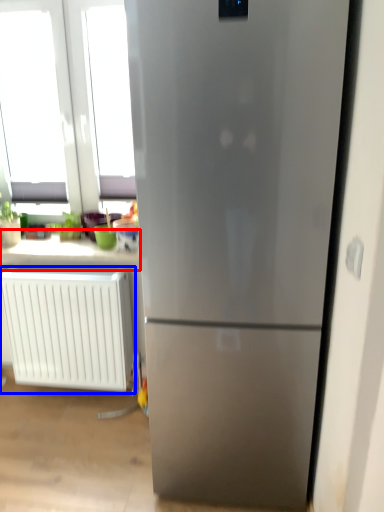
Question: Which of the following is the farthest to the observer, counter top (highlighted by a red box) or radiator (highlighted by a blue box)?

Choices:
 (A) counter top
 (B) radiator

Answer: (A)